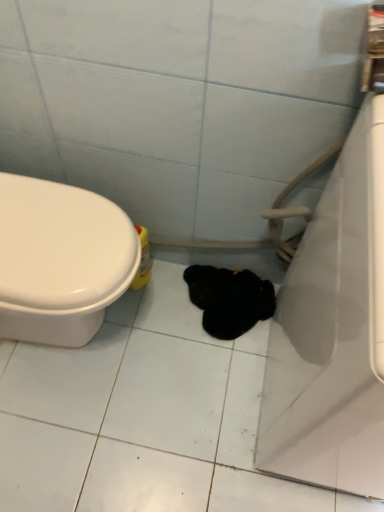
Identify the location of vacant region to the left of black fuzzy animal at center. The height and width of the screenshot is (512, 384). (154, 315).